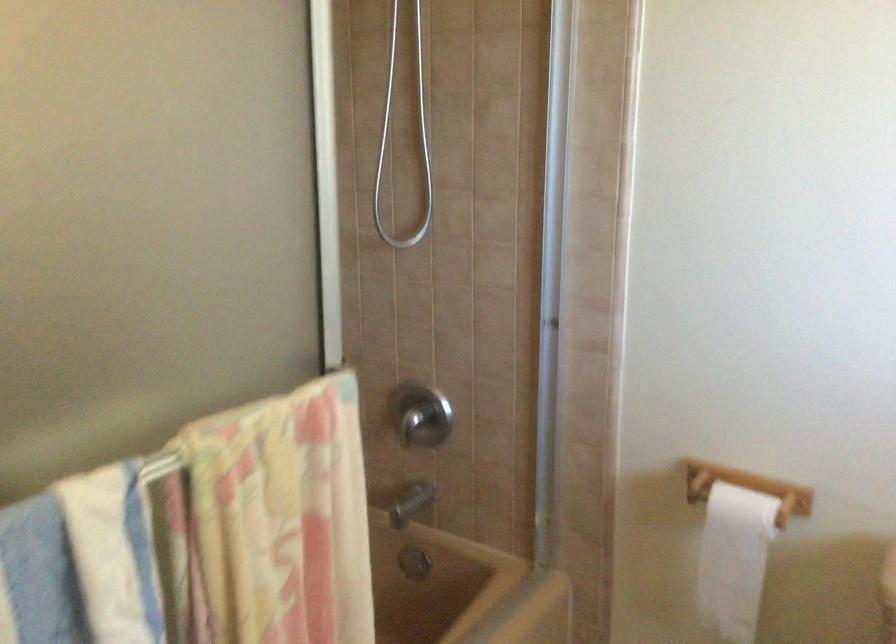
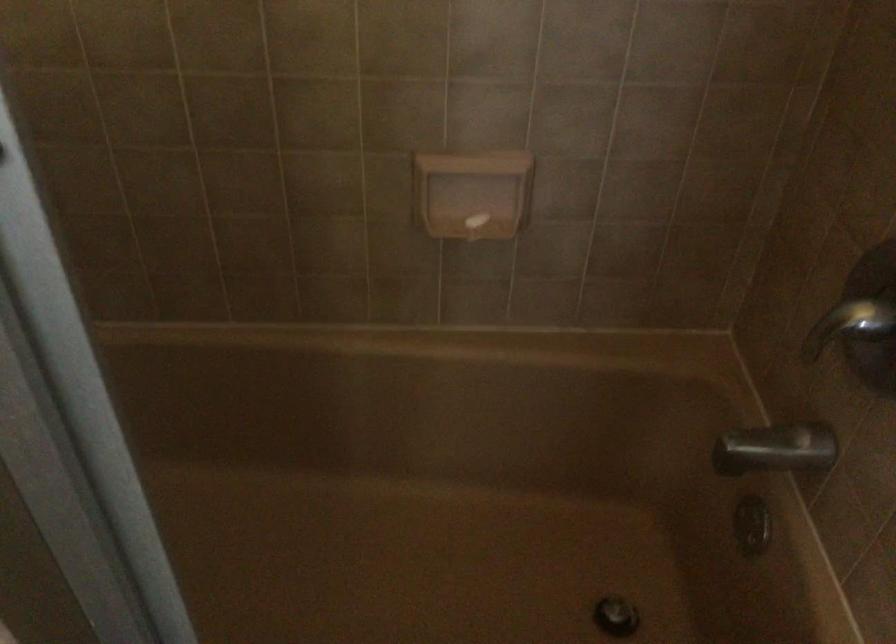
In the second image, find the point that corresponds to point 419,505 in the first image.

(776, 449)